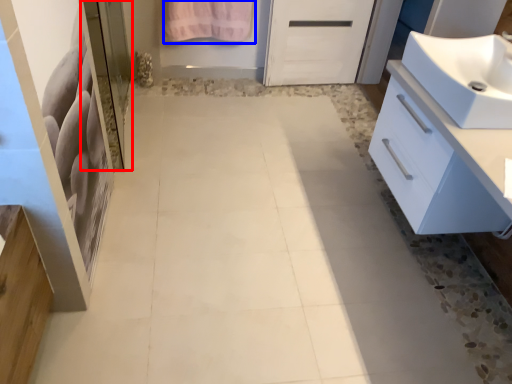
Question: Which object is closer to the camera taking this photo, screen door (highlighted by a red box) or bath towel (highlighted by a blue box)?

Choices:
 (A) screen door
 (B) bath towel

Answer: (A)